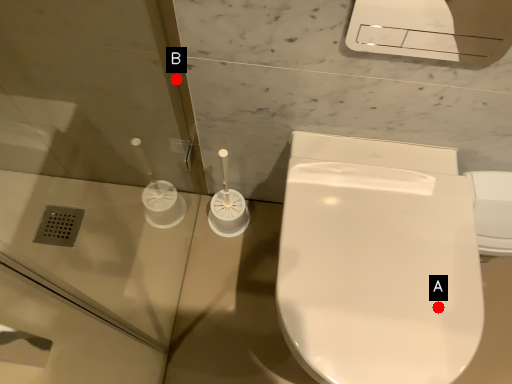
Question: Two points are circled on the image, labeled by A and B beside each circle. Among these points, which one is nearest to the camera?

Choices:
 (A) A is closer
 (B) B is closer

Answer: (A)